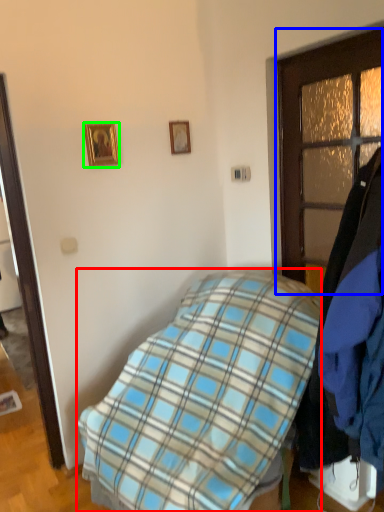
Question: Estimate the real-world distances between objects in this image. Which object is farther from bed (highlighted by a red box), door (highlighted by a blue box) or picture frame (highlighted by a green box)?

Choices:
 (A) door
 (B) picture frame

Answer: (B)